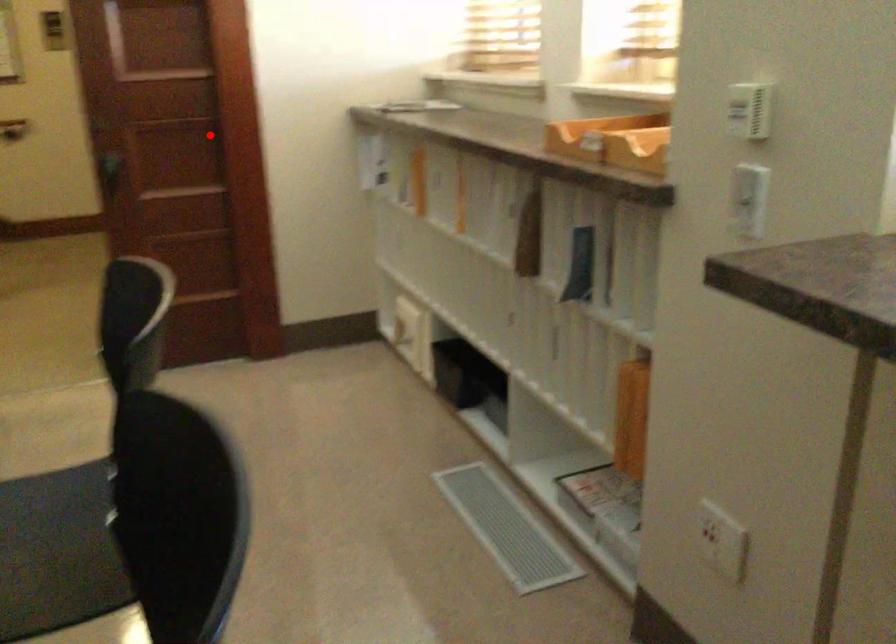
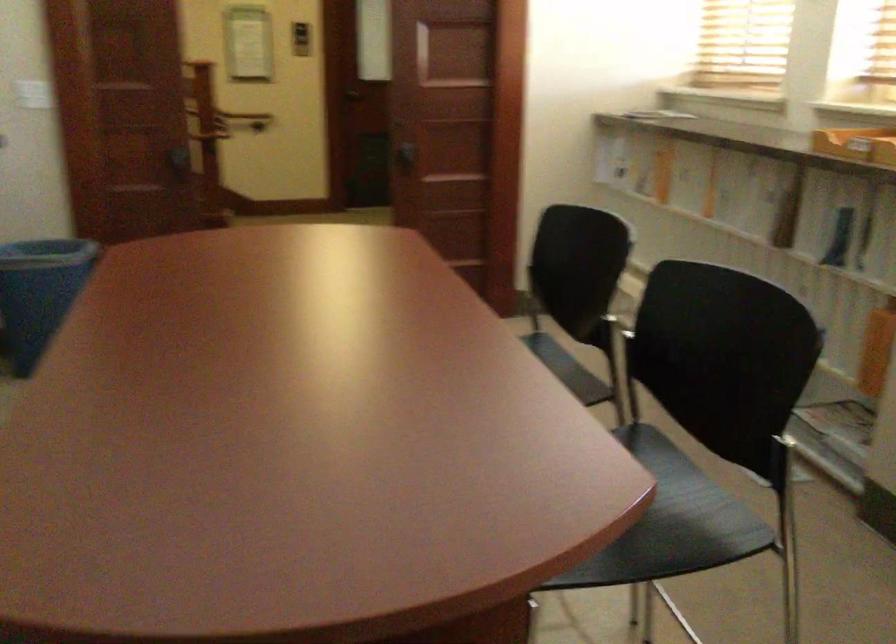
Question: A red point is marked in image1. In image2, is the corresponding 3D point closer to the camera or farther? Reply with the corresponding letter.

Choices:
 (A) The corresponding 3D point is closer.
 (B) The corresponding 3D point is farther.

Answer: (B)